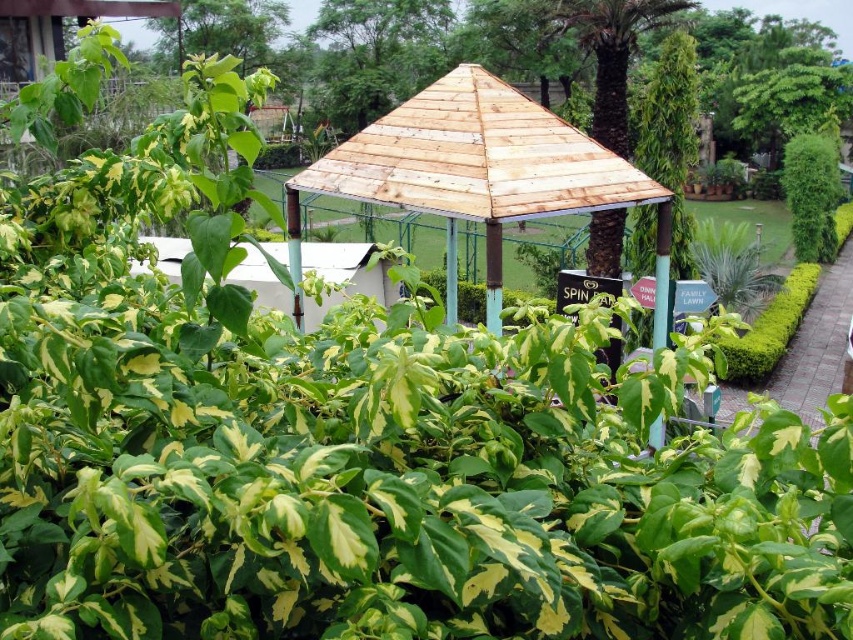
Which of these two, wooden gazebo at center or green leafy bush at upper right, stands shorter?

Standing shorter between the two is wooden gazebo at center.

Can you confirm if wooden gazebo at center is positioned above green leafy bush at upper right?

Incorrect, wooden gazebo at center is not positioned above green leafy bush at upper right.

I want to click on wooden gazebo at center, so click(x=477, y=173).

Where is `wooden gazebo at center`? This screenshot has width=853, height=640. wooden gazebo at center is located at coordinates (477, 173).

What are the coordinates of `brown wooden roof at upper center` in the screenshot? It's located at (376, 54).

Consider the image. Which of these two, brown wooden roof at upper center or green leafy bush at upper right, stands taller?

brown wooden roof at upper center

Which is behind, point (402, 96) or point (801, 225)?

Positioned behind is point (402, 96).

Image resolution: width=853 pixels, height=640 pixels. I want to click on brown wooden roof at upper center, so click(376, 54).

Does wooden gazebo at center have a larger size compared to brown wooden roof at upper center?

No.

Who is more forward, (323,156) or (314,20)?

Point (323,156) is more forward.

Is point (363, 144) in front of point (405, 88)?

Yes.

At what (x,y) coordinates should I click in order to perform the action: click on wooden gazebo at center. Please return your answer as a coordinate pair (x, y). Looking at the image, I should click on coord(477,173).